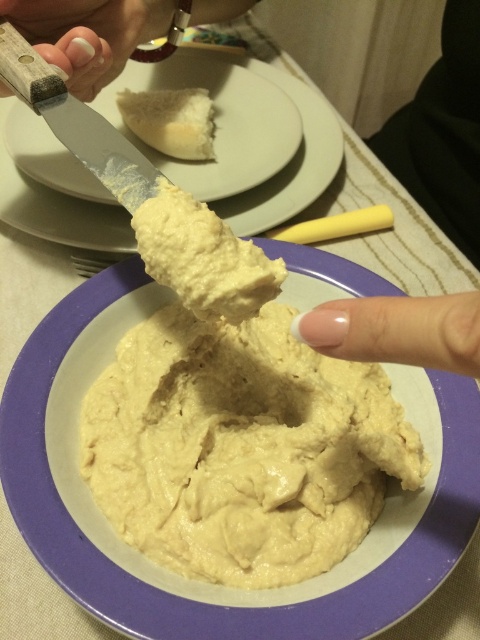
Who is more distant from viewer, (311, 323) or (122, 97)?

The point (122, 97) is behind.

Between white polished nail at center and white crumbly biscuit at upper center, which one appears on the right side from the viewer's perspective?

white polished nail at center

Which is behind, point (407, 332) or point (119, 100)?

The point (119, 100) is more distant.

Locate an element on the screen. white polished nail at center is located at coordinates (397, 330).

Which of these two, creamy beige hummus at center or white crumbly biscuit at upper center, stands shorter?

white crumbly biscuit at upper center

Which of these two, creamy beige hummus at center or white crumbly biscuit at upper center, stands taller?

With more height is creamy beige hummus at center.

What do you see at coordinates (421, 538) in the screenshot?
I see `creamy beige hummus at center` at bounding box center [421, 538].

I want to click on creamy beige hummus at center, so click(421, 538).

At what (x,y) coordinates should I click in order to perform the action: click on creamy beige hummus at center. Please return your answer as a coordinate pair (x, y). This screenshot has height=640, width=480. Looking at the image, I should click on (421, 538).

Is point (21, 618) in front of point (91, 112)?

Yes, it is in front of point (91, 112).

Is point (12, 604) farther from viewer compared to point (95, 157)?

That is True.

The width and height of the screenshot is (480, 640). Identify the location of creamy beige hummus at center. (421, 538).